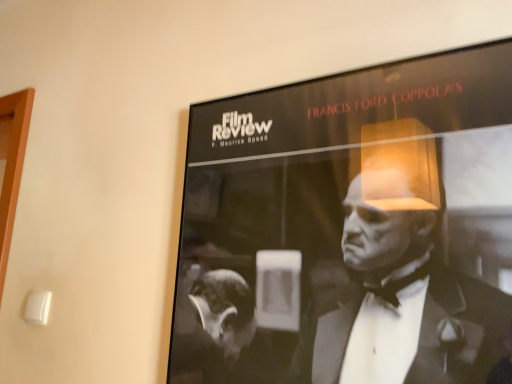
I want to click on black glossy poster at upper right, so click(x=351, y=228).

The height and width of the screenshot is (384, 512). What do you see at coordinates (351, 228) in the screenshot? I see `black glossy poster at upper right` at bounding box center [351, 228].

The image size is (512, 384). What are the coordinates of `black glossy poster at upper right` in the screenshot? It's located at (351, 228).